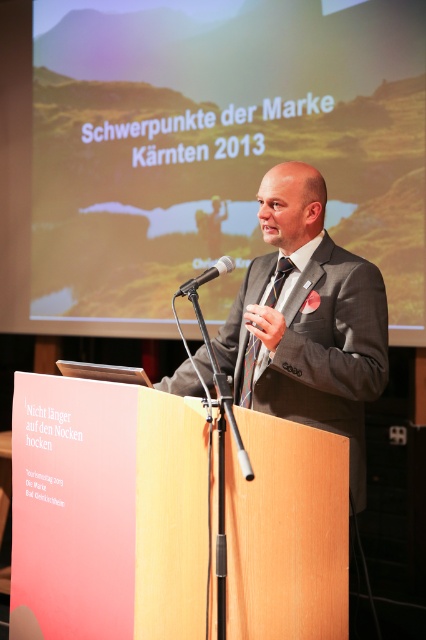
Is point (296, 163) more distant than point (175, 294)?

Yes.

Which is behind, point (192, 394) or point (221, 273)?

The point (192, 394) is more distant.

I want to click on matte black suit at center, so click(307, 321).